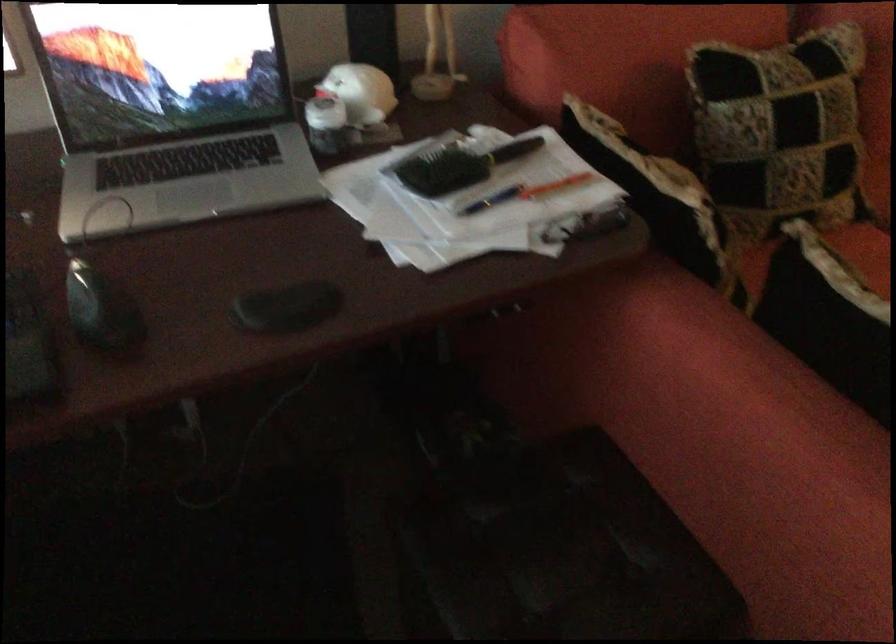
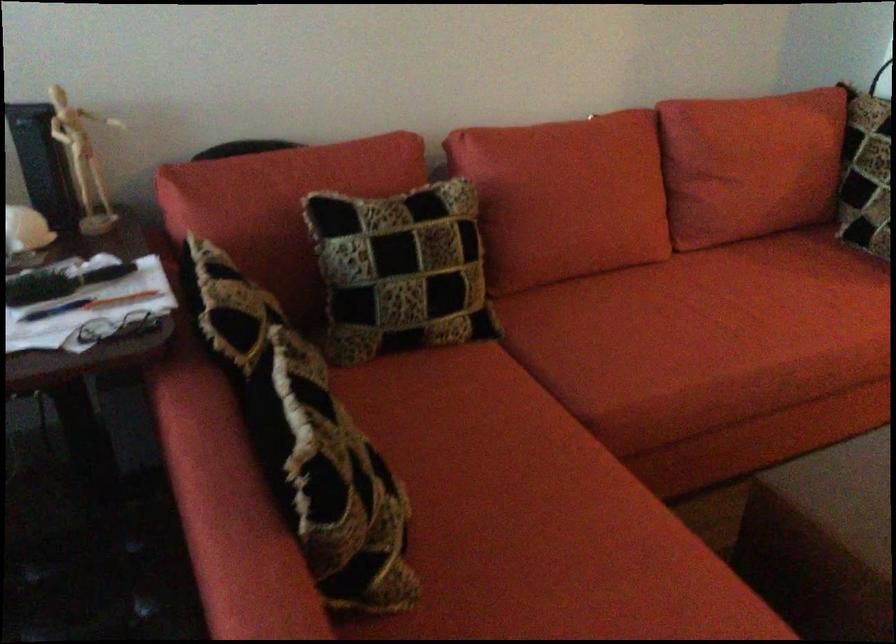
The point at [479,190] is marked in the first image. Where is the corresponding point in the second image?

(55, 310)